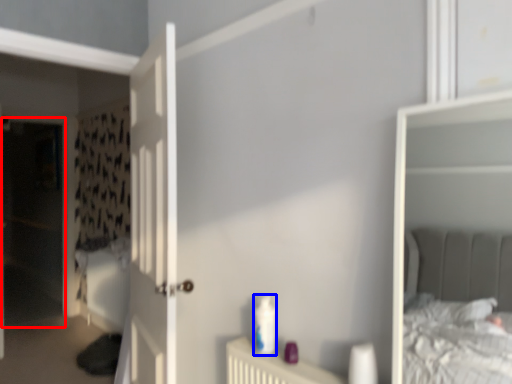
Question: Which object is further to the camera taking this photo, screen door (highlighted by a red box) or toiletry (highlighted by a blue box)?

Choices:
 (A) screen door
 (B) toiletry

Answer: (A)